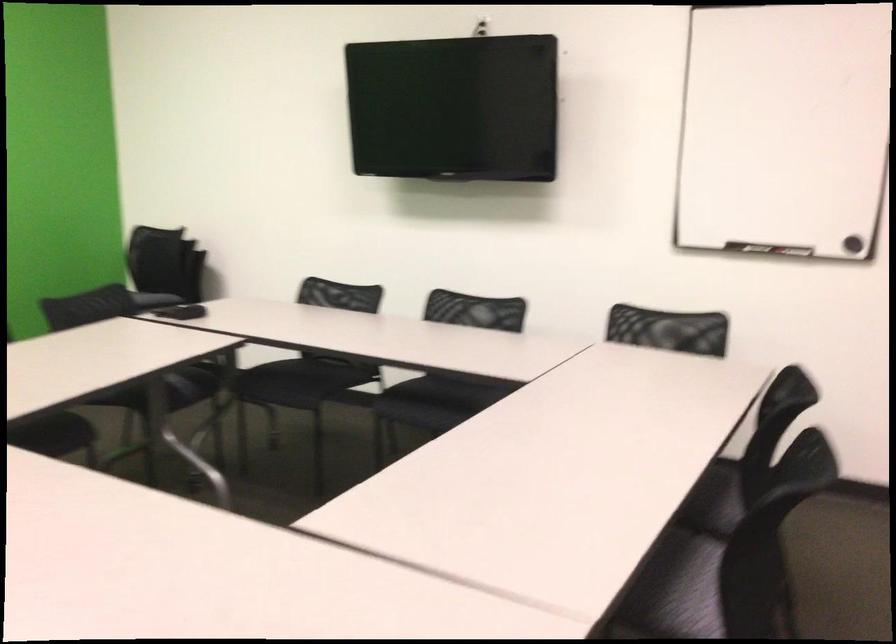
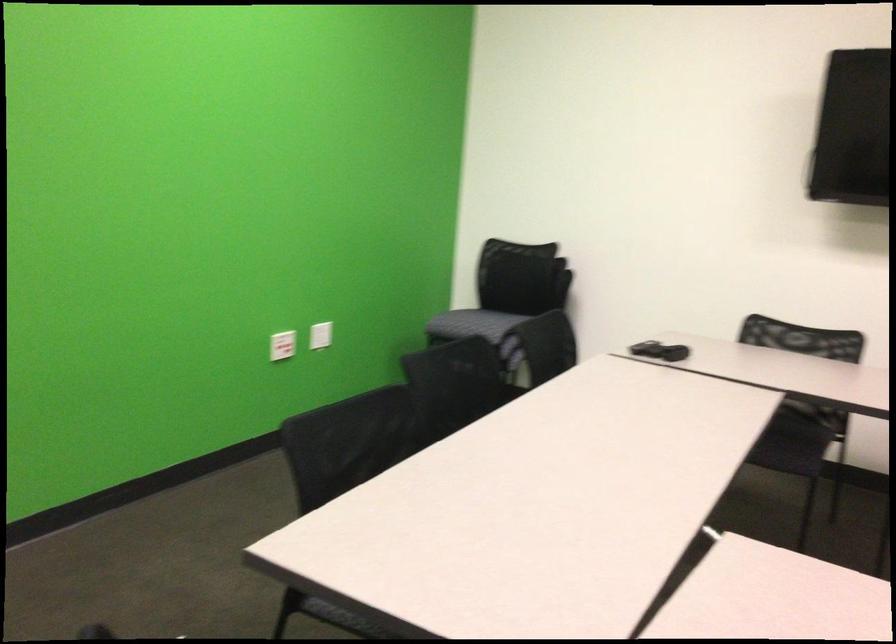
Where in the second image is the point corresponding to point 298,399 from the first image?

(791, 444)